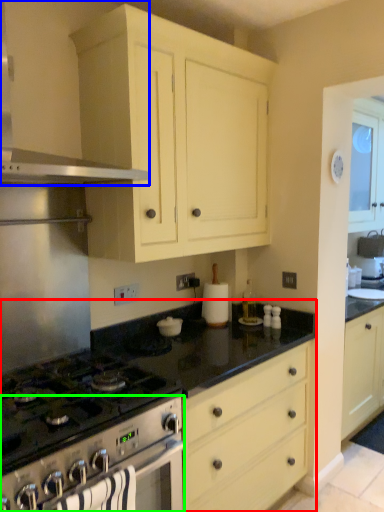
Question: Which object is positioned farthest from countertop (highlighted by a red box)? Select from kitchen appliance (highlighted by a blue box) and oven (highlighted by a green box).

Choices:
 (A) kitchen appliance
 (B) oven

Answer: (A)